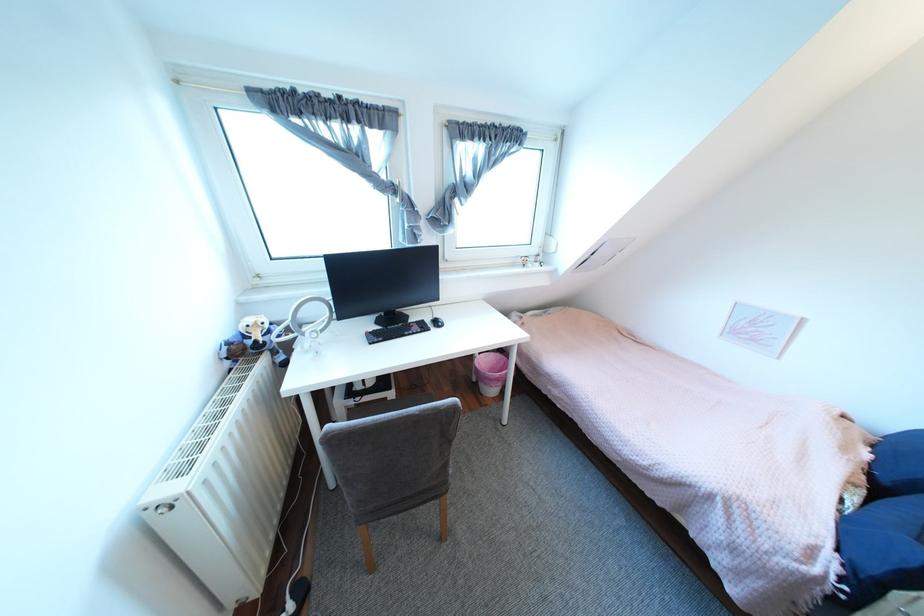
The width and height of the screenshot is (924, 616). I want to click on white window handle, so click(398, 190).